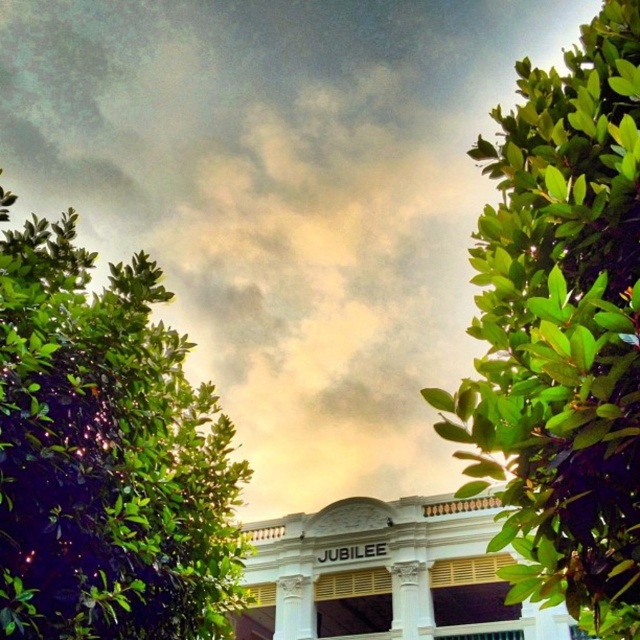
Question: Which point is farther from the camera taking this photo?

Choices:
 (A) (97, 536)
 (B) (596, 620)

Answer: (A)

Question: Can you confirm if green glossy leaves at right is positioned below green leafy tree at left?

Choices:
 (A) yes
 (B) no

Answer: (B)

Question: Does green glossy leaves at right appear under green leafy tree at left?

Choices:
 (A) no
 (B) yes

Answer: (A)

Question: Which object is farther from the camera taking this photo?

Choices:
 (A) green leafy tree at left
 (B) green glossy leaves at right

Answer: (A)

Question: Considering the relative positions of green glossy leaves at right and green leafy tree at left in the image provided, where is green glossy leaves at right located with respect to green leafy tree at left?

Choices:
 (A) right
 (B) left

Answer: (A)